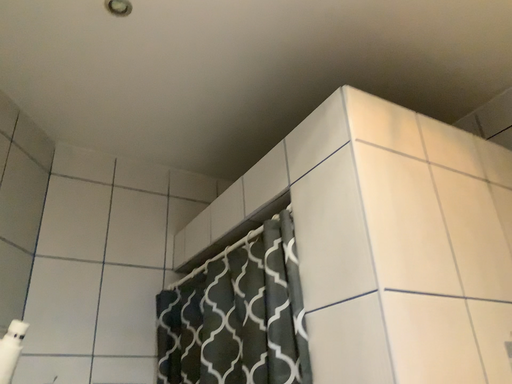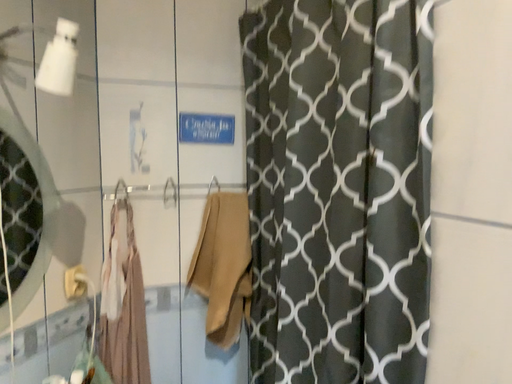
Question: How did the camera likely rotate when shooting the video?

Choices:
 (A) rotated right
 (B) rotated left

Answer: (B)